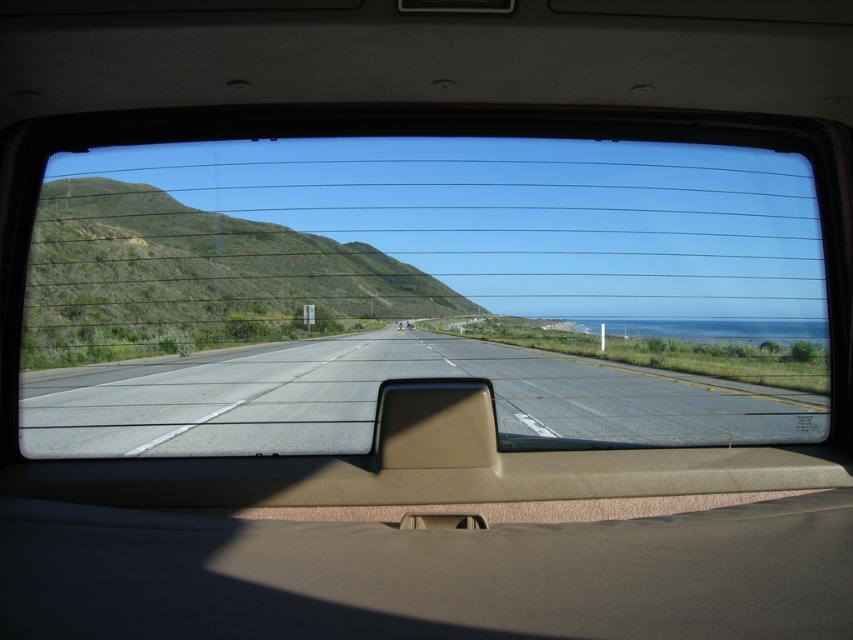
Question: Among these points, which one is farthest from the camera?

Choices:
 (A) (386, 428)
 (B) (675, 403)
 (C) (485, 333)

Answer: (C)

Question: From the image, what is the correct spatial relationship of transparent glass windshield at center in relation to asphalt road at center?

Choices:
 (A) below
 (B) above

Answer: (B)

Question: Among these points, which one is farthest from the camera?

Choices:
 (A) (207, 353)
 (B) (45, 452)
 (C) (489, 428)

Answer: (A)

Question: From the image, what is the correct spatial relationship of asphalt road at center in relation to tan matte rearview mirror at center?

Choices:
 (A) above
 (B) below

Answer: (B)

Question: Does transparent glass windshield at center have a greater width compared to tan matte rearview mirror at center?

Choices:
 (A) no
 (B) yes

Answer: (B)

Question: Which point is farther from the camera taking this photo?

Choices:
 (A) (134, 424)
 (B) (476, 428)
 (C) (590, 372)

Answer: (C)